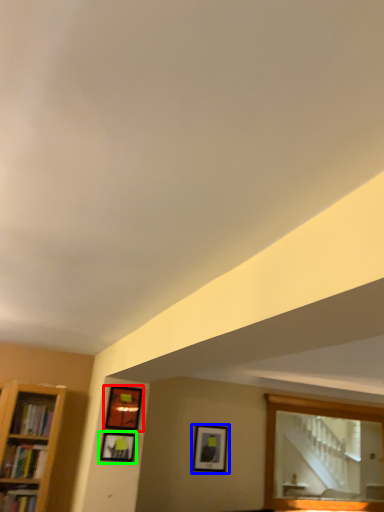
Question: Estimate the real-world distances between objects in this image. Which object is farther from picture frame (highlighted by a red box), picture frame (highlighted by a blue box) or picture frame (highlighted by a green box)?

Choices:
 (A) picture frame
 (B) picture frame

Answer: (A)